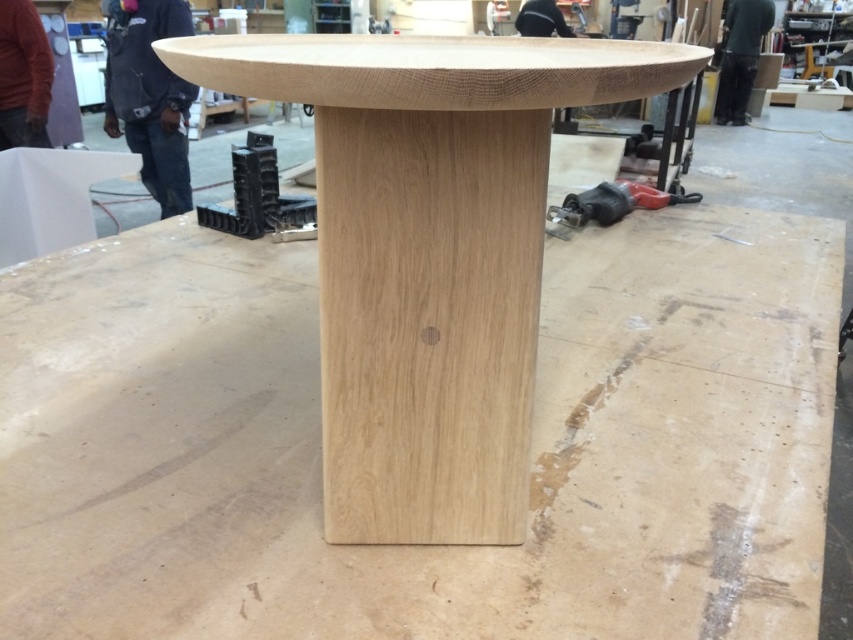
Question: From the image, what is the correct spatial relationship of natural wood table at center in relation to red plastic drill at lower right?

Choices:
 (A) right
 (B) left

Answer: (B)

Question: Among these points, which one is nearest to the camera?

Choices:
 (A) (637, 205)
 (B) (433, 237)

Answer: (B)

Question: Which of the following is the farthest from the observer?

Choices:
 (A) (676, 196)
 (B) (376, 120)

Answer: (A)

Question: Does natural wood table at center appear under red plastic drill at lower right?

Choices:
 (A) yes
 (B) no

Answer: (A)

Question: Can you confirm if natural wood table at center is smaller than red plastic drill at lower right?

Choices:
 (A) no
 (B) yes

Answer: (A)